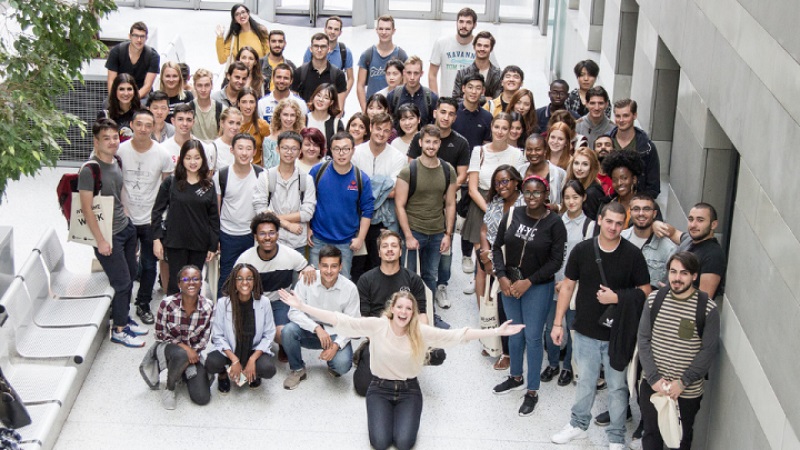
At what (x,y) coordinates should I click in order to perform the action: click on glass doors. Please return your answer as a coordinate pair (x, y). Looking at the image, I should click on (298, 5), (330, 2), (405, 3), (449, 6), (509, 6).